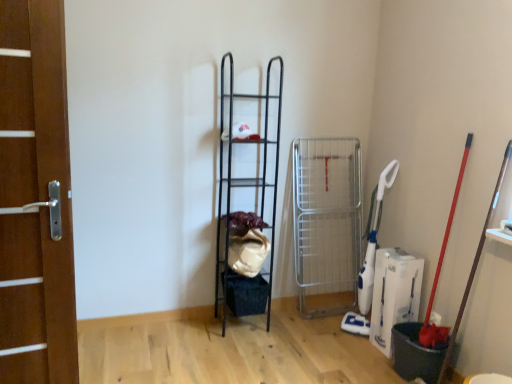
Locate an element on the screen. free space in front of black metal shelf at center is located at coordinates pos(233,351).